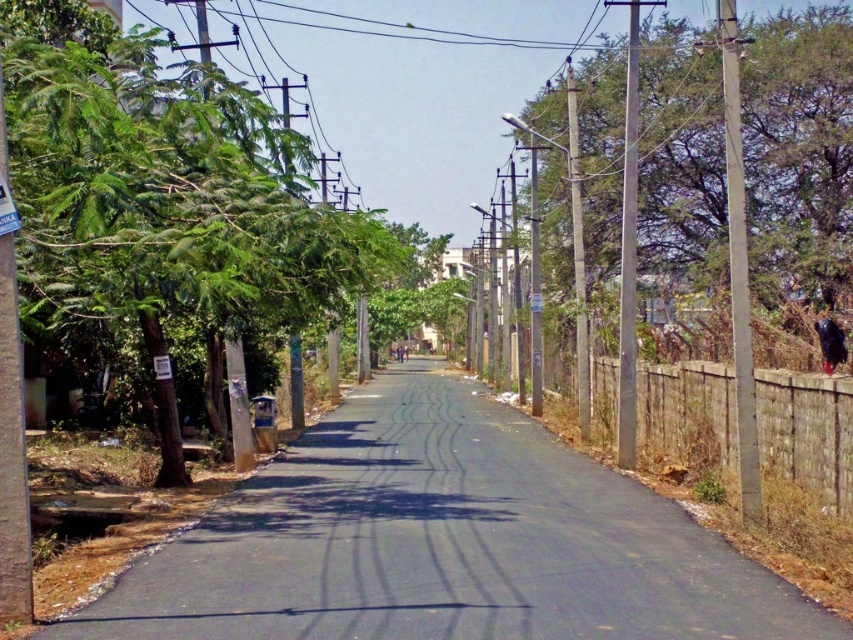
You are a delivery driver who needs to pass under a low clearance bridge ahead. You see the black asphalt road at center and the green leafy tree at left in your view. Which object has a lower height that might pose a clearance issue for your truck?

The black asphalt road at center has a lesser height compared to the green leafy tree at left, so the black asphalt road at center might pose a clearance issue for the truck.

You are standing at the point with coordinates (444, 541) in the image. What is the object directly beneath your feet?

The black asphalt road at center is located at point (444, 541), so the object directly beneath your feet is the black asphalt road at center.